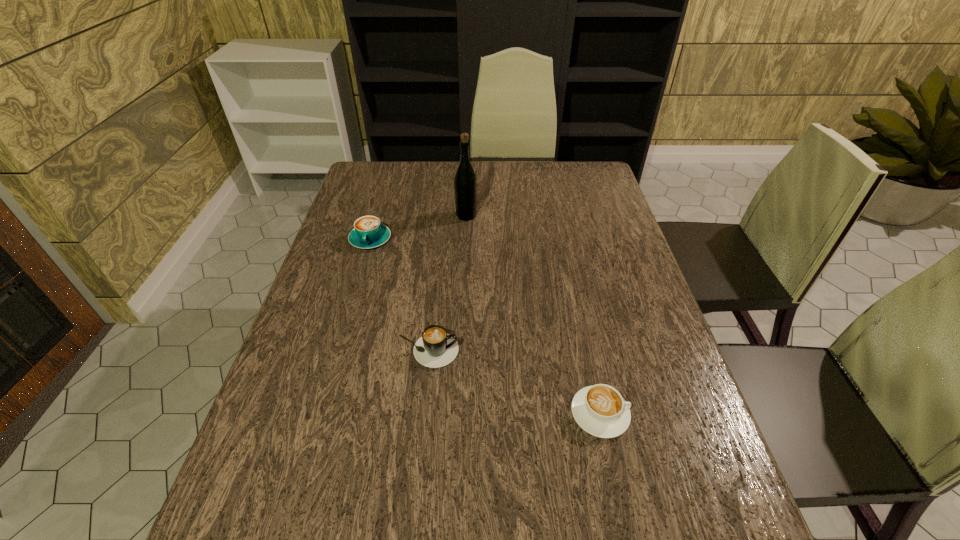
This screenshot has width=960, height=540. I want to click on unoccupied area between the leftmost cappuccino and the farthest object, so click(419, 227).

At what (x,y) coordinates should I click in order to perform the action: click on blank region between the tallest object and the leftmost object. Please return your answer as a coordinate pair (x, y). Looking at the image, I should click on (419, 227).

At what (x,y) coordinates should I click in order to perform the action: click on empty location between the second nearest object and the shortest cappuccino. Please return your answer as a coordinate pair (x, y). Looking at the image, I should click on (514, 382).

At what (x,y) coordinates should I click in order to perform the action: click on free space between the shortest object and the beer bottle. Please return your answer as a coordinate pair (x, y). Image resolution: width=960 pixels, height=540 pixels. Looking at the image, I should click on click(533, 315).

At what (x,y) coordinates should I click in order to perform the action: click on empty space between the tallest object and the second nearest cappuccino. Please return your answer as a coordinate pair (x, y). The width and height of the screenshot is (960, 540). Looking at the image, I should click on (447, 284).

The width and height of the screenshot is (960, 540). What are the coordinates of `free spot between the second nearest cappuccino and the leftmost cappuccino` in the screenshot? It's located at [399, 295].

This screenshot has width=960, height=540. What are the coordinates of `vacant space that's between the second farthest cappuccino and the farthest object` in the screenshot? It's located at (447, 284).

The width and height of the screenshot is (960, 540). In order to click on unoccupied area between the second cappuccino from left to right and the tallest object in this screenshot , I will do `click(447, 284)`.

This screenshot has height=540, width=960. I want to click on object that ranks as the third closest to the leftmost cappuccino, so [x=600, y=410].

Locate an element on the screen. object that is the third closest one to the second nearest object is located at coordinates (465, 183).